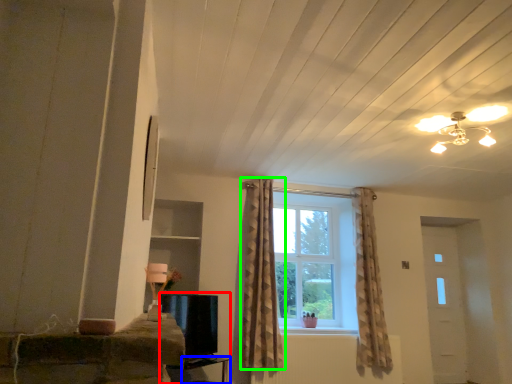
Question: Which is nearer to the entertainment center (highlighted by a red box)? table (highlighted by a blue box) or curtain (highlighted by a green box).

Choices:
 (A) table
 (B) curtain

Answer: (A)